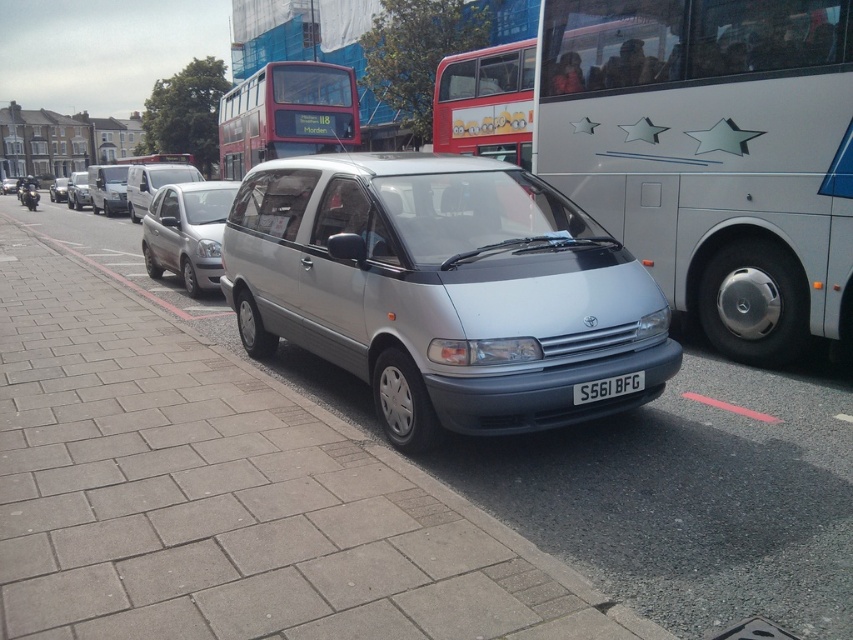
Question: Which point is farther to the camera?

Choices:
 (A) tap(50, 342)
 (B) tap(198, 280)
 (C) tap(51, 182)
 (D) tap(604, 384)

Answer: (C)

Question: Which of these objects is positioned closest to the satin silver van at center?

Choices:
 (A) white metallic bus at right
 (B) silver metallic van at center
 (C) red metallic bus at upper center
 (D) black plastic license plate at center

Answer: (B)

Question: In this image, where is silver metallic sedan at center located relative to black plastic license plate at center?

Choices:
 (A) right
 (B) left

Answer: (B)

Question: Can you confirm if black plastic license plate at center is positioned above silver metallic van at center?

Choices:
 (A) yes
 (B) no

Answer: (B)

Question: Is satin silver minivan at center to the left of silver metallic van at left from the viewer's perspective?

Choices:
 (A) no
 (B) yes

Answer: (A)

Question: Estimate the real-world distances between objects in this image. Which object is farther from the silver metallic van at left?

Choices:
 (A) satin silver minivan at center
 (B) silver metallic sedan at center

Answer: (A)